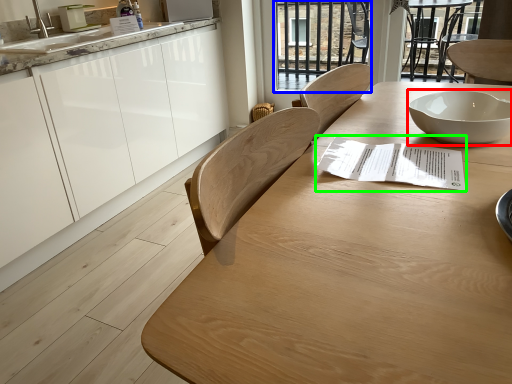
Question: Estimate the real-world distances between objects in this image. Which object is farther from bowl (highlighted by a red box), glass door (highlighted by a blue box) or paper (highlighted by a green box)?

Choices:
 (A) glass door
 (B) paper

Answer: (A)